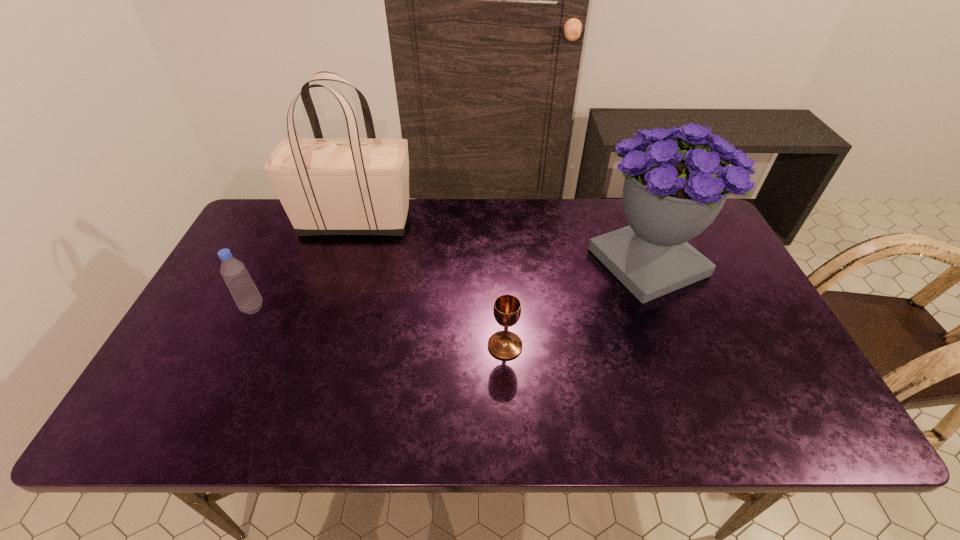
I want to click on bouquet positioned at the far edge, so click(671, 194).

Find the location of `shopping bag located at the left edge`. shopping bag located at the left edge is located at coordinates (327, 186).

Find the location of a particular element. bottle located in the left edge section of the desktop is located at coordinates (239, 282).

Where is `object that is at the right edge`? The height and width of the screenshot is (540, 960). object that is at the right edge is located at coordinates (671, 194).

I want to click on object present at the far left corner, so click(327, 186).

Identify the location of object that is at the far right corner. (671, 194).

Identify the location of free space at the far edge of the desktop. Image resolution: width=960 pixels, height=540 pixels. (523, 204).

The image size is (960, 540). Find the location of `vacant space at the near edge of the desktop`. vacant space at the near edge of the desktop is located at coordinates (507, 404).

You are a GUI agent. You are given a task and a screenshot of the screen. Output one action in this format:
    pyautogui.click(x=<x>, y=<y>)
    Task: Click on the vacant area at the left edge of the desktop
    The width and height of the screenshot is (960, 540).
    Given the screenshot: What is the action you would take?
    pyautogui.click(x=271, y=247)

Where is `vacant space at the right edge of the desktop`? The width and height of the screenshot is (960, 540). vacant space at the right edge of the desktop is located at coordinates (744, 322).